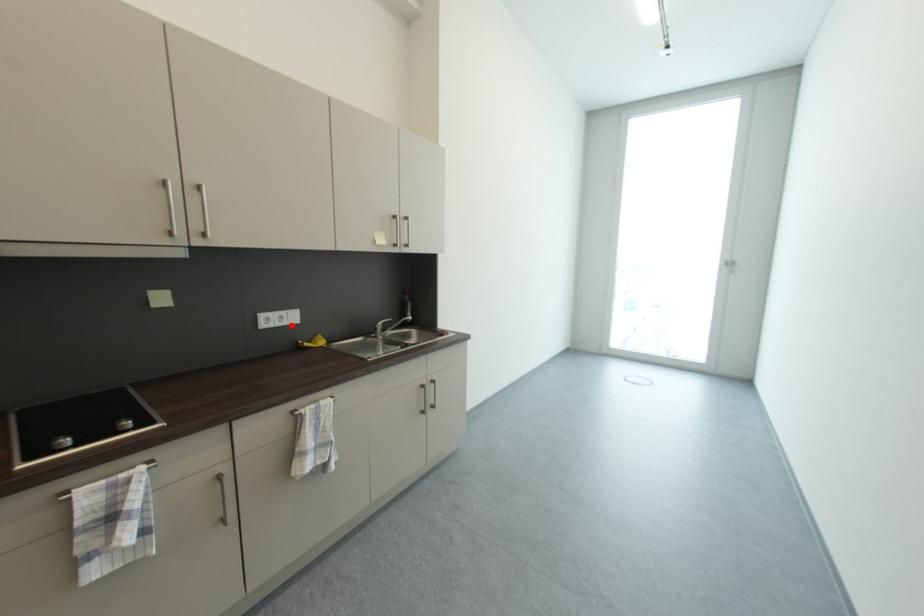
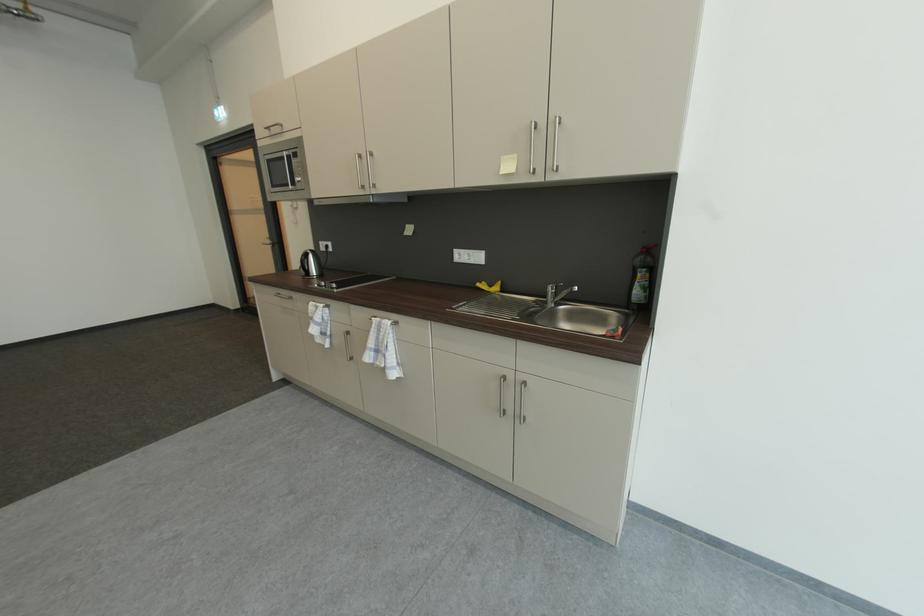
Question: I am providing you with two images of the same scene from different viewpoints. Given a red point in image1, look at the same physical point in image2. Is it:

Choices:
 (A) Closer to the viewpoint
 (B) Farther from the viewpoint

Answer: (B)